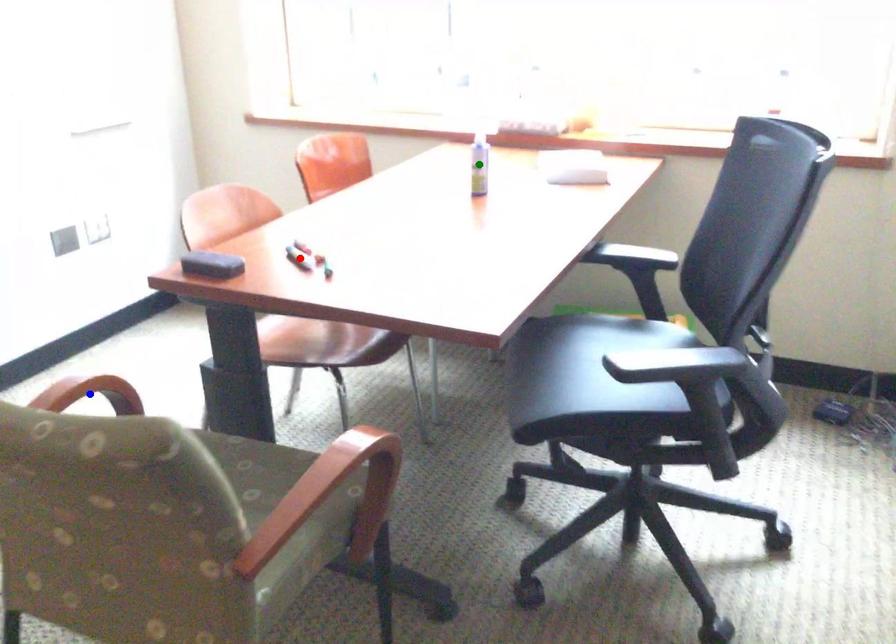
Order these from nearest to farthest:
1. blue point
2. green point
3. red point

blue point
red point
green point